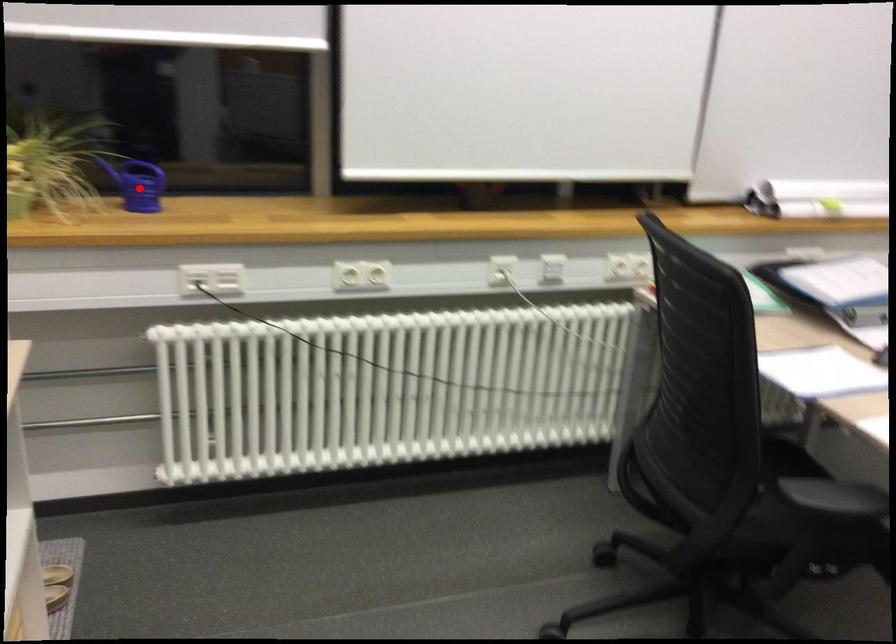
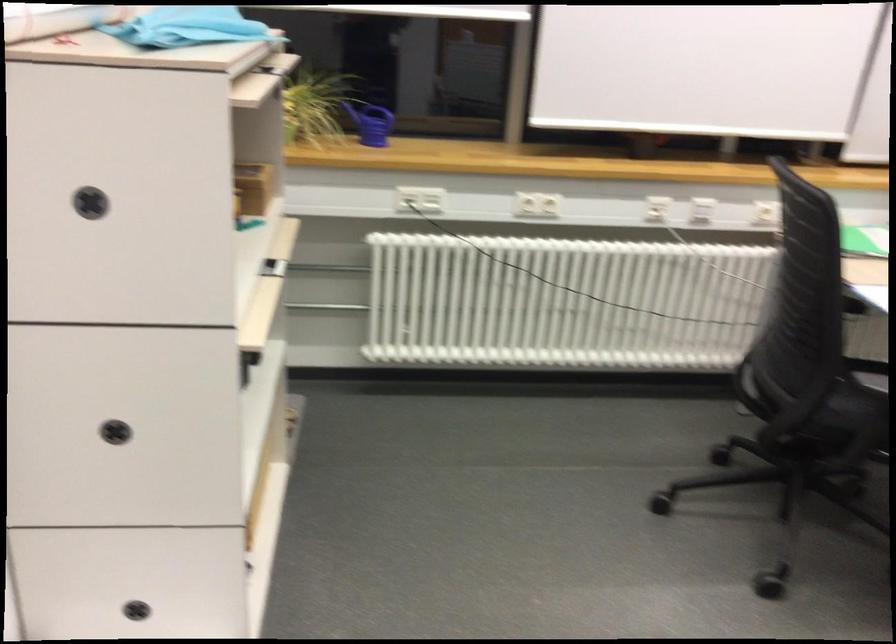
Locate, in the second image, the point that corresponds to the highlighted location in the first image.

(371, 122)